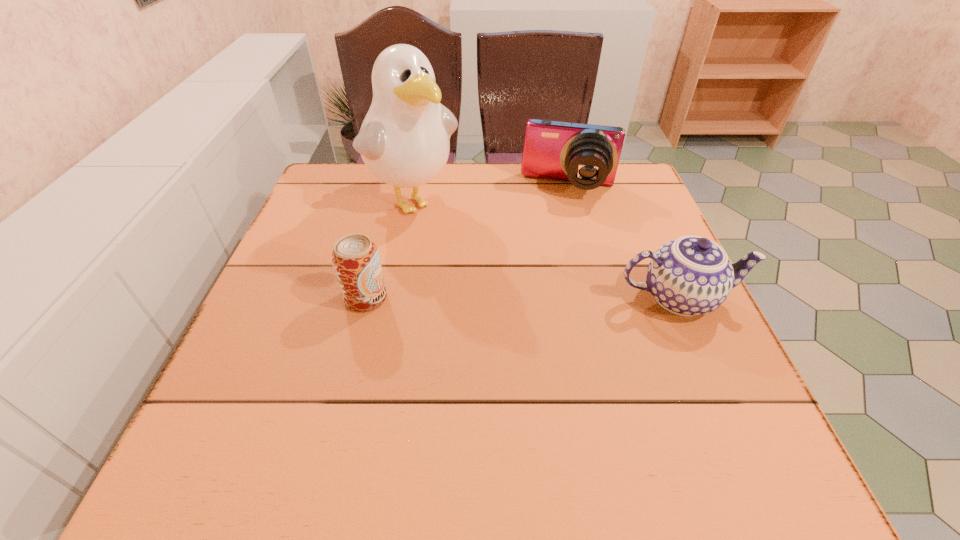
Locate an element on the screen. vacant space that is in between the chinaware and the gull is located at coordinates tap(545, 248).

The image size is (960, 540). I want to click on free space between the camera and the chinaware, so click(624, 243).

You are a GUI agent. You are given a task and a screenshot of the screen. Output one action in this format:
    pyautogui.click(x=<x>, y=<y>)
    Task: Click on the object that ranks as the closest to the gull
    This screenshot has height=540, width=960.
    Given the screenshot: What is the action you would take?
    click(x=587, y=155)

The image size is (960, 540). In order to click on object that can be found as the second closest to the chinaware in this screenshot , I will do `click(404, 140)`.

Identify the location of vacant space that satisfies the following two spatial constraints: 1. on the back side of the tallest object; 2. on the right side of the beer can. This screenshot has height=540, width=960. (391, 199).

This screenshot has height=540, width=960. I want to click on vacant region that satisfies the following two spatial constraints: 1. on the back side of the camera; 2. on the left side of the beer can, so click(x=394, y=188).

Identify the location of vacant space that satisfies the following two spatial constraints: 1. on the front side of the chinaware; 2. at the spout of the camera. (597, 298).

Identify the location of free point that satisfies the following two spatial constraints: 1. on the front side of the tallest object; 2. at the spout of the chinaware. (391, 298).

This screenshot has height=540, width=960. What are the coordinates of `blank area in the image that satisfies the following two spatial constraints: 1. on the front side of the beer can; 2. at the spout of the chinaware` in the screenshot? It's located at (366, 298).

Where is `vacant position in the image that satisfies the following two spatial constraints: 1. on the front side of the beer can; 2. at the spout of the chinaware`? The image size is (960, 540). vacant position in the image that satisfies the following two spatial constraints: 1. on the front side of the beer can; 2. at the spout of the chinaware is located at coordinates (366, 298).